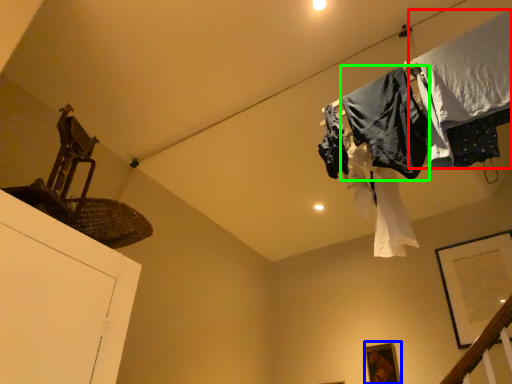
Question: Which object is positioned farthest from clothing (highlighted by a red box)? Select from picture frame (highlighted by a blue box) and clothing (highlighted by a green box).

Choices:
 (A) picture frame
 (B) clothing

Answer: (A)